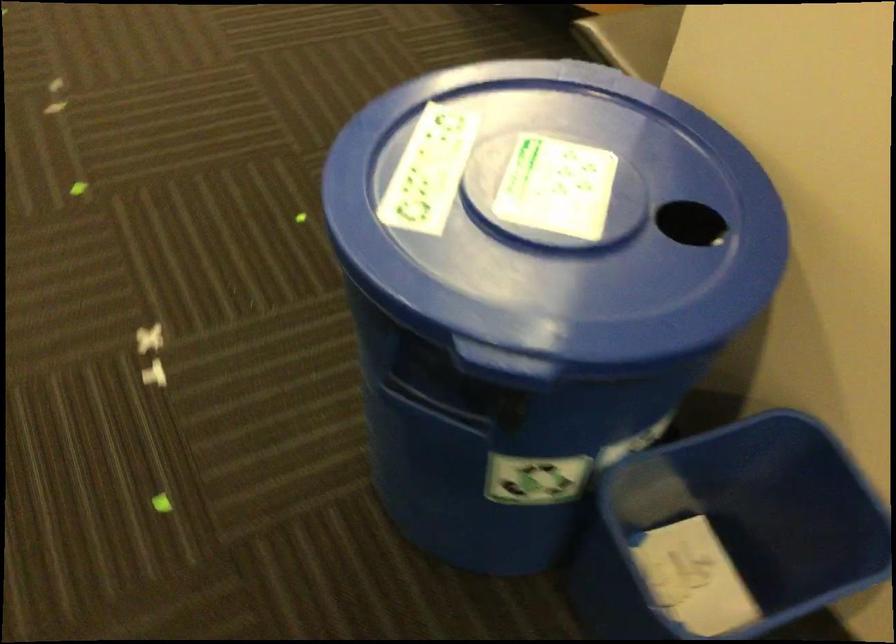
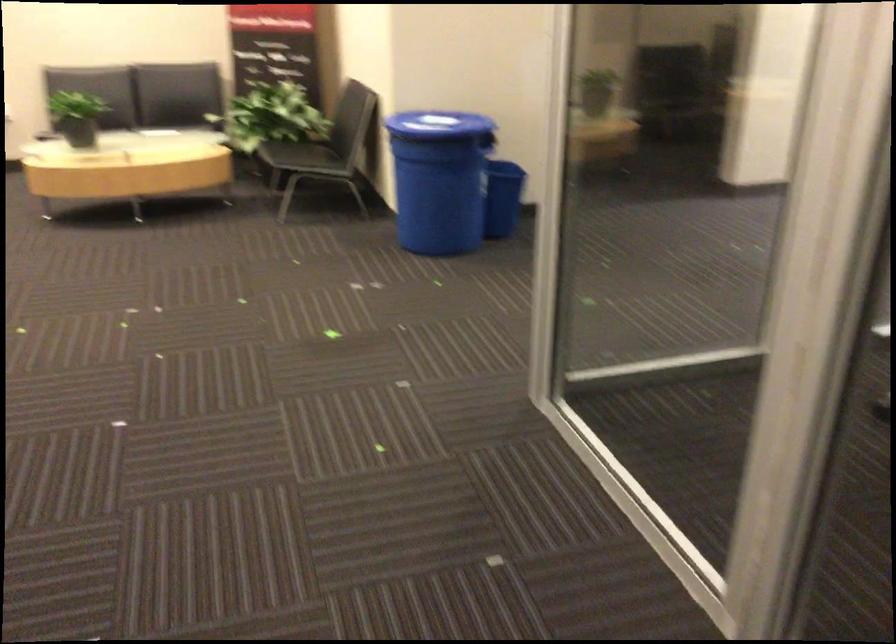
Question: I am providing you with two images of the same scene from different viewpoints. After the viewpoint changes to image2, which objects are now occluded?

Choices:
 (A) black chair sitting surface
 (B) trash can opening
 (C) dark chair sitting surface
 (D) blue trash can lid

Answer: (B)